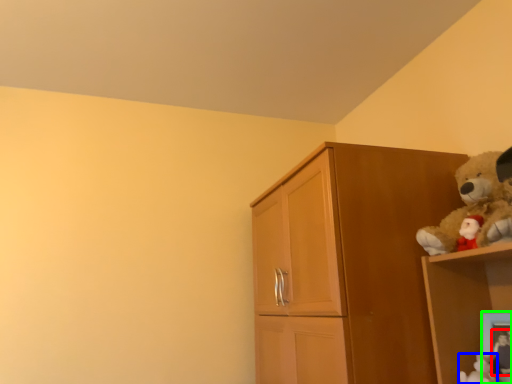
Question: Estimate the real-world distances between objects in this image. Which object is closer to toy (highlighted by a red box), toy (highlighted by a blue box) or picture frame (highlighted by a green box)?

Choices:
 (A) toy
 (B) picture frame

Answer: (B)